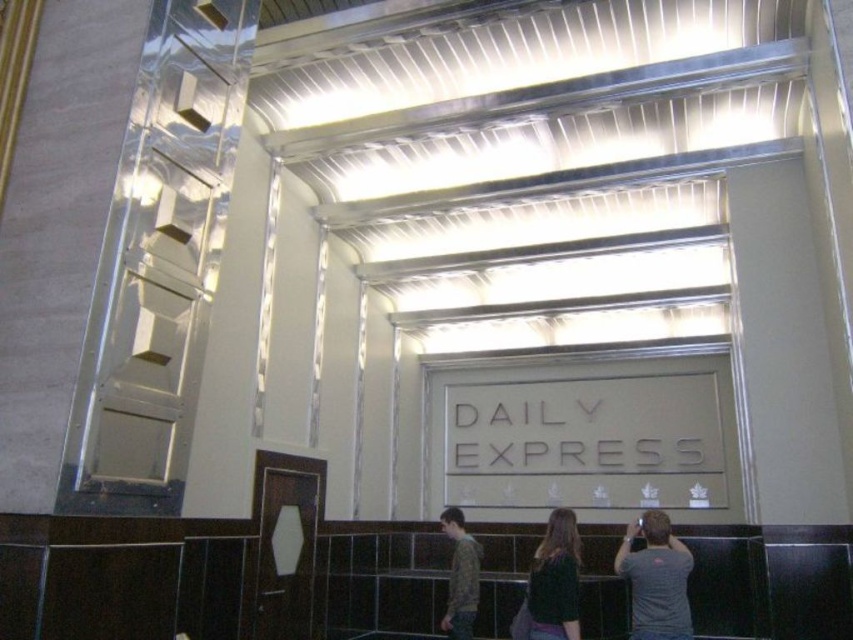
Does dark brown leather jacket at center lie in front of camouflage-patterned shirt at lower center?

Yes, it is.

Identify the location of dark brown leather jacket at center. Image resolution: width=853 pixels, height=640 pixels. (555, 580).

Between point (654, 605) and point (465, 564), which one is positioned behind?

Positioned behind is point (465, 564).

Measure the distance between gray t-shirt at center and camouflage-patterned shirt at lower center.

A distance of 4.79 feet exists between gray t-shirt at center and camouflage-patterned shirt at lower center.

Measure the distance between gray t-shirt at center and camera.

gray t-shirt at center is 4.72 meters away from camera.

At what (x,y) coordinates should I click in order to perform the action: click on gray t-shirt at center. Please return your answer as a coordinate pair (x, y). This screenshot has width=853, height=640. Looking at the image, I should click on (656, 579).

Is gray t-shirt at center taller than dark brown leather jacket at center?

Yes.

Can you confirm if gray t-shirt at center is positioned above dark brown leather jacket at center?

Incorrect, gray t-shirt at center is not positioned above dark brown leather jacket at center.

Is point (682, 557) closer to viewer compared to point (538, 637)?

No, it is not.

Locate an element on the screen. gray t-shirt at center is located at coordinates (656, 579).